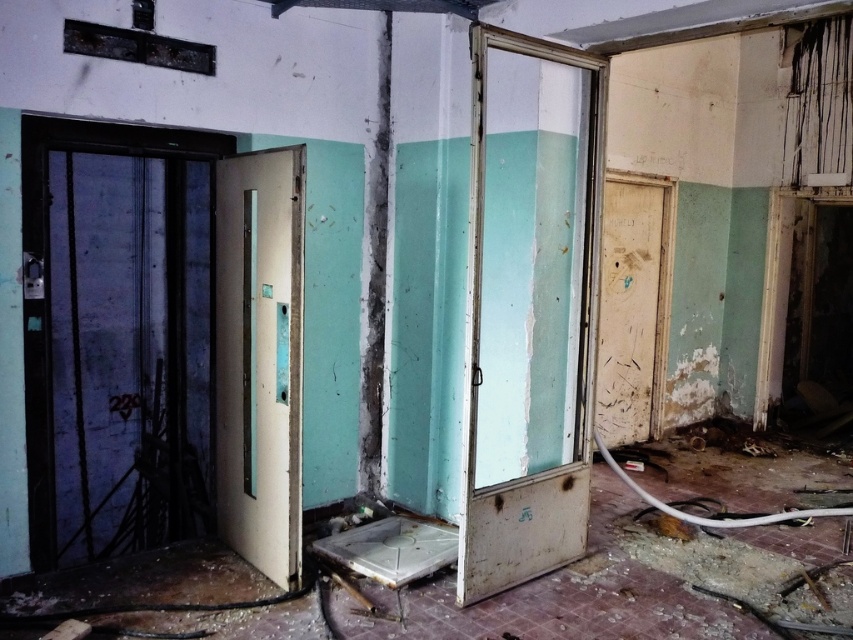
You are a maintenance worker needing to pass through one of the doors. The white matte door at center is narrower than the worn wood door at right. Which door should you choose to ensure you can fit through comfortably?

The worn wood door at right has a greater width than the white matte door at center, so you should choose the worn wood door at right to ensure comfortable passage.

You are inside the dilapidated building and want to exit through the nearest door. You see the peeling paint door at center and the white matte door at center. Which door is closer to your current position?

The white matte door at center is closer to your current position because the peeling paint door at center is to the right of it, implying it is further away.

You are a maintenance worker tasked with replacing doors in this dilapidated building. You need to choose between the peeling paint door at center and the white matte door at center. Which door should you choose if you want to replace the wider one?

The peeling paint door at center might be wider than the white matte door at center, so you should choose the peeling paint door at center for replacement if you want to replace the wider one.